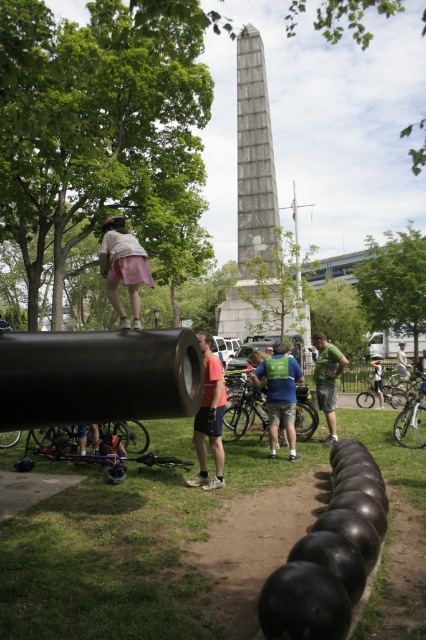
You are standing at the origin point in the image and want to find the matte pink shorts at center. According to the coordinates provided, in which direction should you move to locate it?

The matte pink shorts at center is located at coordinates point (210, 417), so you should move towards the right and slightly upwards from the origin to find it.

You are a photographer positioned at the front of the scene. You want to take a photo that includes both the matte pink shorts at center and the blue fabric shirt at center. Which object will appear larger in your photo?

The matte pink shorts at center will appear larger in the photo because it is closer to the viewer than the blue fabric shirt at center.

You are a photographer trying to capture a photo of both the gray stone obelisk at center and the green fabric shirt at center. Since you want both subjects to be clearly visible in the frame, which one should you focus on first to ensure proper focus, considering their sizes?

The gray stone obelisk at center is taller than the green fabric shirt at center, so you should focus on the gray stone obelisk at center first to ensure proper focus, as it occupies more space in the frame.